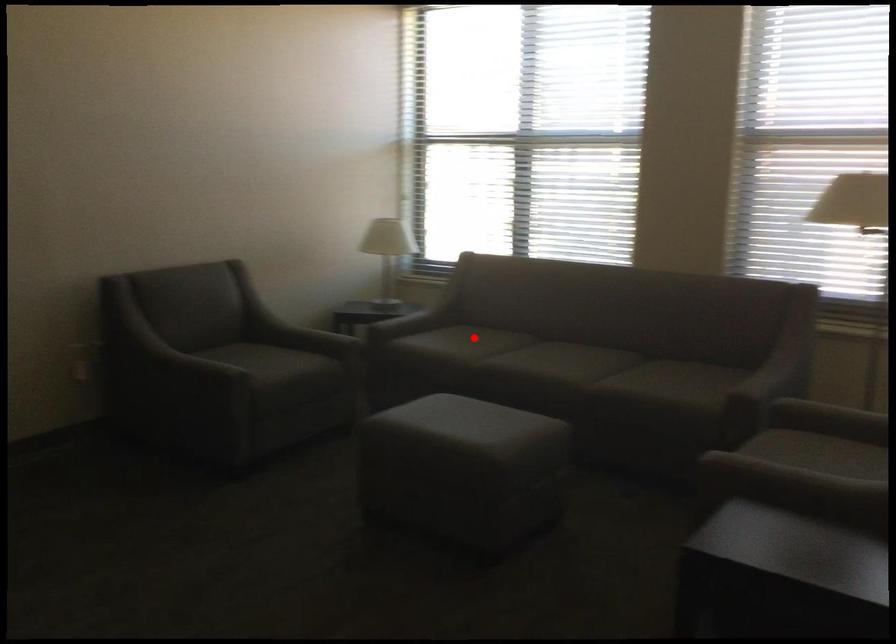
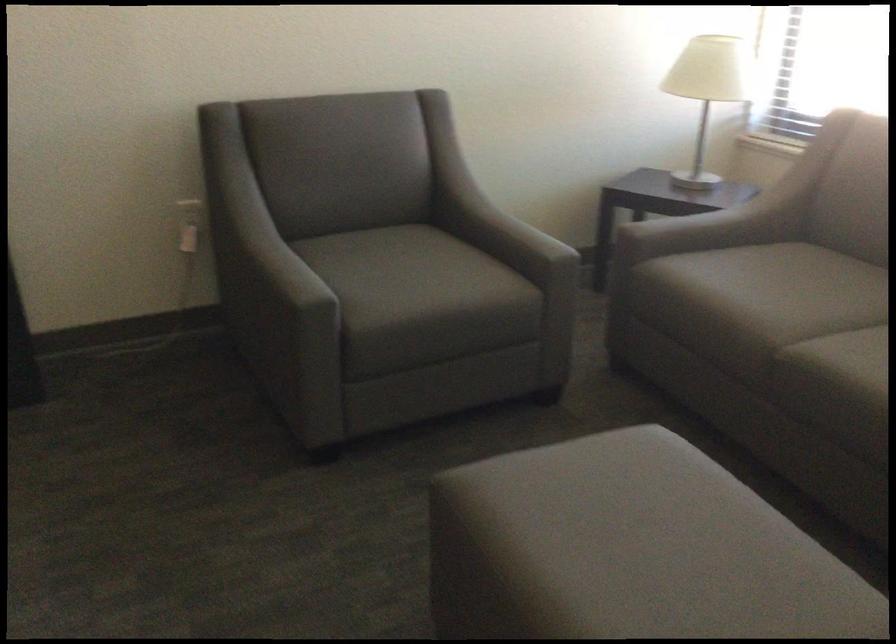
In the second image, find the point that corresponds to the highlighted location in the first image.

(797, 292)